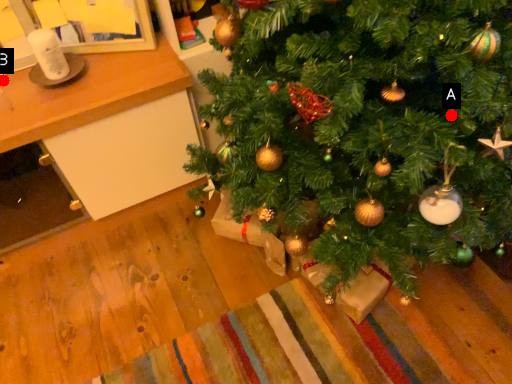
Question: Two points are circled on the image, labeled by A and B beside each circle. Among these points, which one is nearest to the camera?

Choices:
 (A) A is closer
 (B) B is closer

Answer: (A)